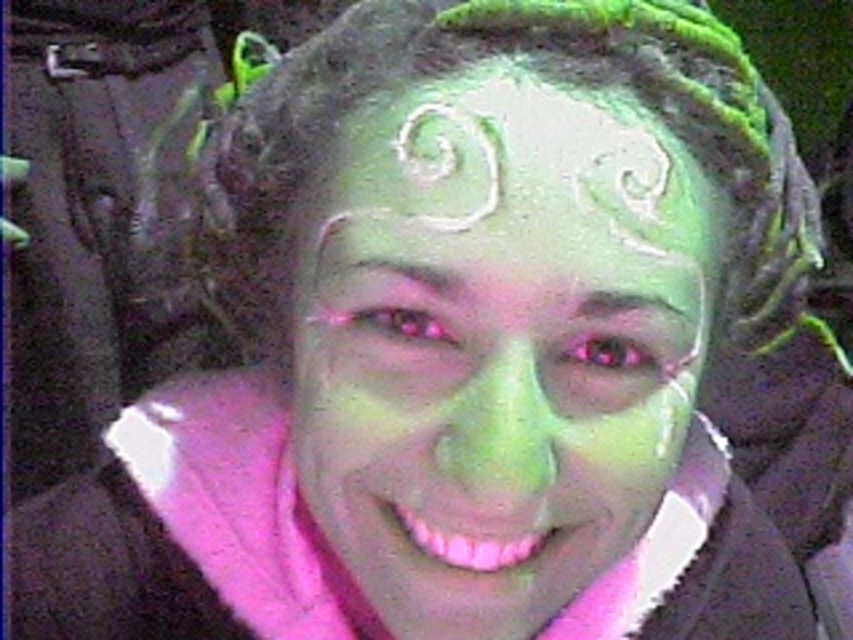
Does green matte face paint at center have a larger size compared to white matte forehead at center?

Yes, green matte face paint at center is bigger than white matte forehead at center.

I want to click on green matte face paint at center, so click(x=503, y=355).